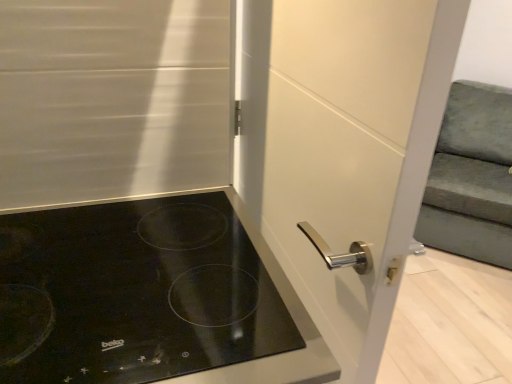
Question: From the image's perspective, is velvet green armchair at right on white glossy door handle at center?

Choices:
 (A) yes
 (B) no

Answer: (A)

Question: Considering the relative sizes of velvet green armchair at right and white glossy door handle at center in the image provided, is velvet green armchair at right bigger than white glossy door handle at center?

Choices:
 (A) no
 (B) yes

Answer: (B)

Question: Is velvet green armchair at right smaller than white glossy door handle at center?

Choices:
 (A) no
 (B) yes

Answer: (A)

Question: Can you confirm if velvet green armchair at right is taller than white glossy door handle at center?

Choices:
 (A) no
 (B) yes

Answer: (A)

Question: Is velvet green armchair at right to the left of white glossy door handle at center from the viewer's perspective?

Choices:
 (A) yes
 (B) no

Answer: (B)

Question: Would you say velvet green armchair at right is a long distance from white glossy door handle at center?

Choices:
 (A) no
 (B) yes

Answer: (B)

Question: From the image's perspective, is white glossy door handle at center located beneath black glass cooktop at lower left?

Choices:
 (A) no
 (B) yes

Answer: (A)

Question: From a real-world perspective, is white glossy door handle at center physically above black glass cooktop at lower left?

Choices:
 (A) no
 (B) yes

Answer: (B)

Question: Can black glass cooktop at lower left be found inside white glossy door handle at center?

Choices:
 (A) no
 (B) yes

Answer: (A)

Question: Is the surface of white glossy door handle at center in direct contact with black glass cooktop at lower left?

Choices:
 (A) yes
 (B) no

Answer: (B)

Question: From the image's perspective, is white glossy door handle at center on black glass cooktop at lower left?

Choices:
 (A) no
 (B) yes

Answer: (B)

Question: Considering the relative positions of white glossy door handle at center and black glass cooktop at lower left in the image provided, is white glossy door handle at center behind black glass cooktop at lower left?

Choices:
 (A) no
 (B) yes

Answer: (B)

Question: From a real-world perspective, is white glossy door handle at center beneath velvet green armchair at right?

Choices:
 (A) no
 (B) yes

Answer: (A)